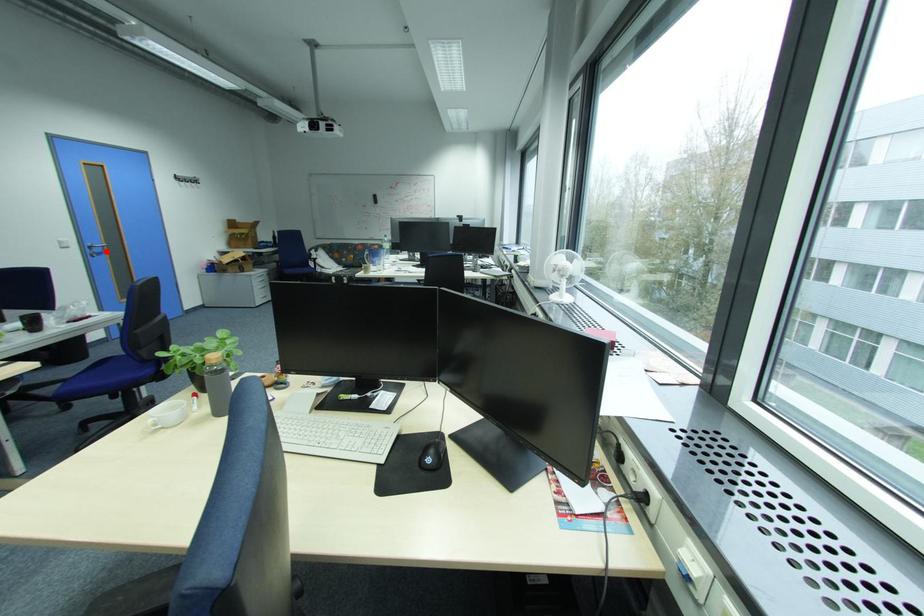
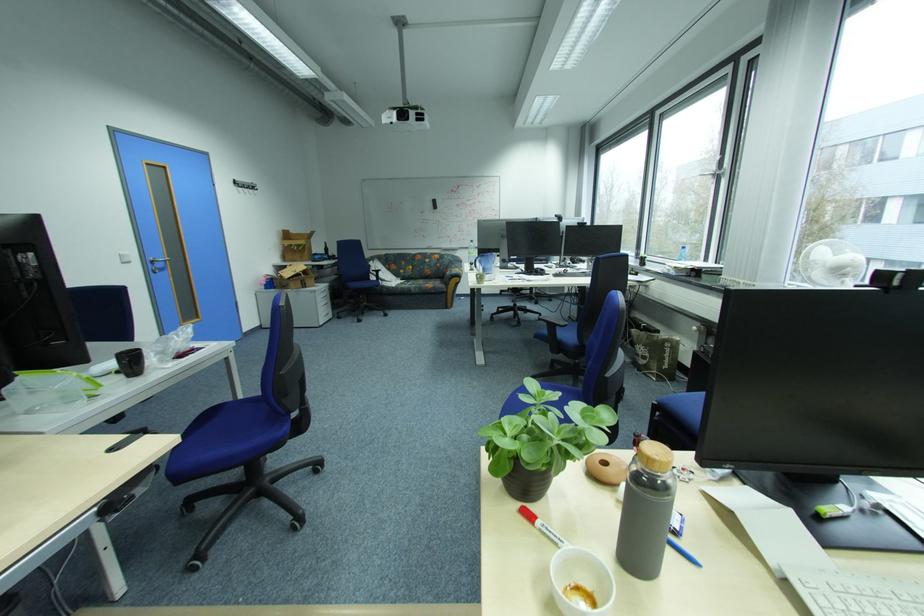
The point at the highlighted location is marked in the first image. Where is the corresponding point in the second image?

(167, 265)